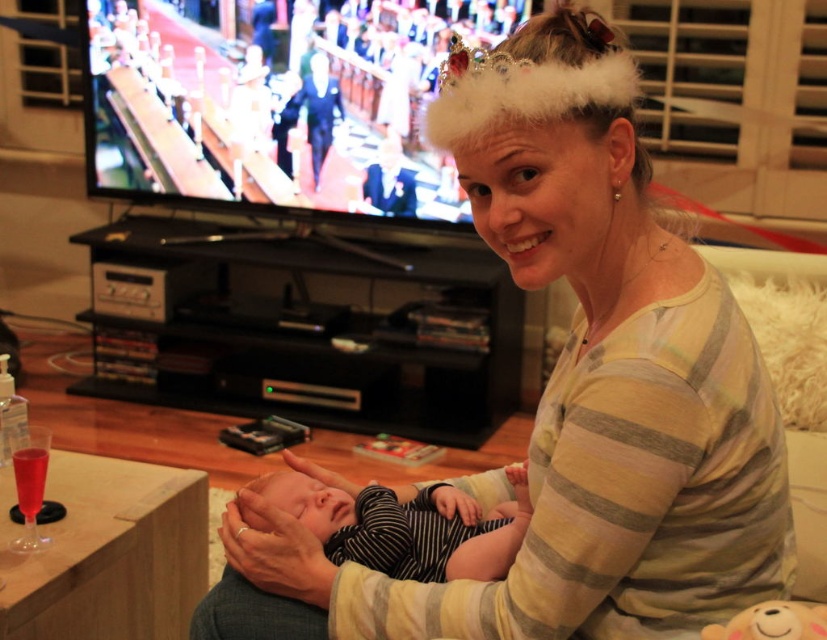
Is point (705, 522) more distant than point (434, 532)?

No.

Which is in front, point (715, 342) or point (385, 541)?

Positioned in front is point (715, 342).

The height and width of the screenshot is (640, 827). What do you see at coordinates (571, 394) in the screenshot?
I see `striped cotton shirt at center` at bounding box center [571, 394].

Locate an element on the screen. striped cotton shirt at center is located at coordinates (571, 394).

Between striped cotton shirt at center and fluffy plush bear at lower right, which one is positioned higher?

striped cotton shirt at center is above.

Does striped cotton shirt at center have a smaller size compared to fluffy plush bear at lower right?

No, striped cotton shirt at center is not smaller than fluffy plush bear at lower right.

This screenshot has width=827, height=640. In order to click on striped cotton shirt at center in this screenshot , I will do `click(571, 394)`.

Is black striped onesie at center smaller than fluffy plush bear at lower right?

No.

Looking at this image, is black striped onesie at center above fluffy plush bear at lower right?

Yes, black striped onesie at center is above fluffy plush bear at lower right.

Is point (505, 563) less distant than point (766, 612)?

No, it is behind (766, 612).

This screenshot has height=640, width=827. Identify the location of black striped onesie at center. (405, 525).